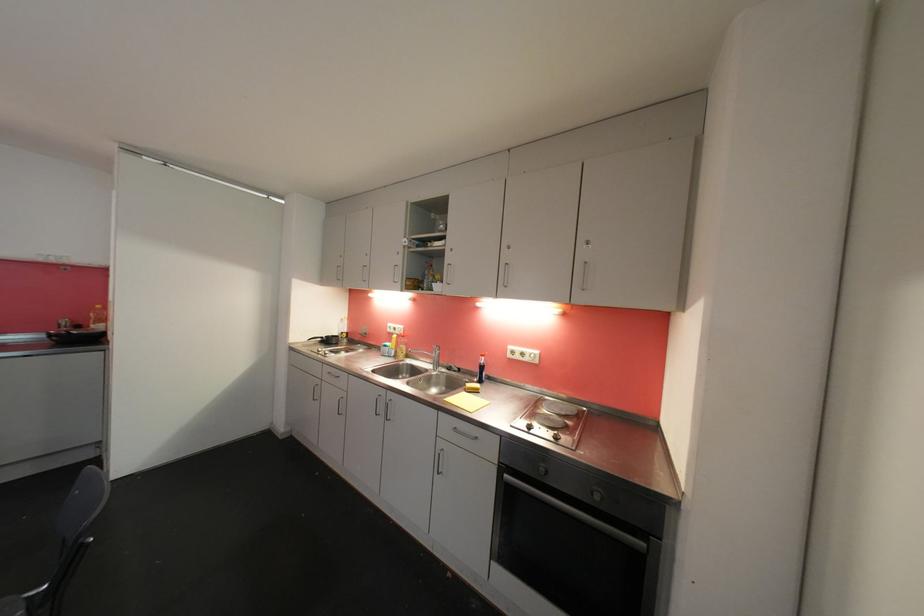
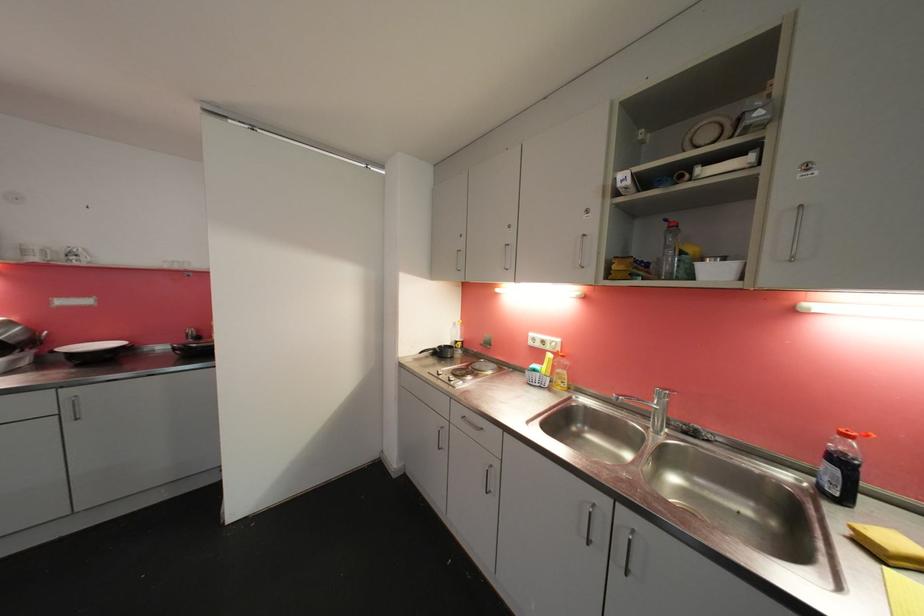
Find the pixel in the second image that matches (399,339) in the first image.

(554, 358)